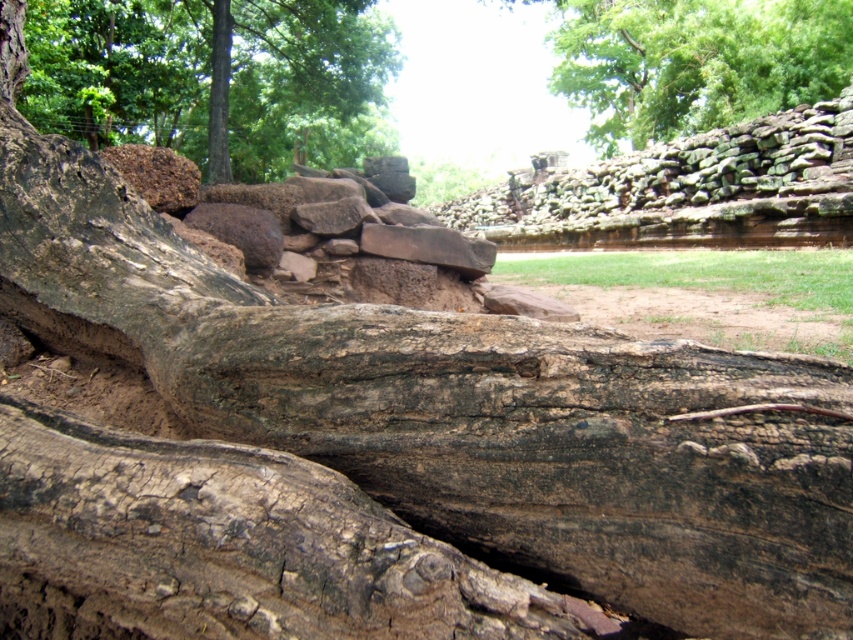
Which is behind, point (309, 113) or point (585, 76)?

Point (585, 76)

Between brown rough tree trunk at upper left and green leafy tree at upper center, which one has less height?

With less height is brown rough tree trunk at upper left.

Where is `brown rough tree trunk at upper left`? The height and width of the screenshot is (640, 853). brown rough tree trunk at upper left is located at coordinates (120, 72).

Between point (381, 40) and point (524, 211), which one is positioned behind?

The point (524, 211) is behind.

Does brown rough tree trunk at upper left appear on the right side of rustic stone wall at upper center?

No, brown rough tree trunk at upper left is not to the right of rustic stone wall at upper center.

Which is in front, point (317, 65) or point (840, 92)?

Point (840, 92) is more forward.

What are the coordinates of `brown rough tree trunk at upper left` in the screenshot? It's located at (120, 72).

Is point (653, 3) positioned before point (737, 129)?

No.

Does point (625, 109) come closer to viewer compared to point (790, 198)?

That is False.

Image resolution: width=853 pixels, height=640 pixels. I want to click on green leafy tree at upper center, so click(x=694, y=61).